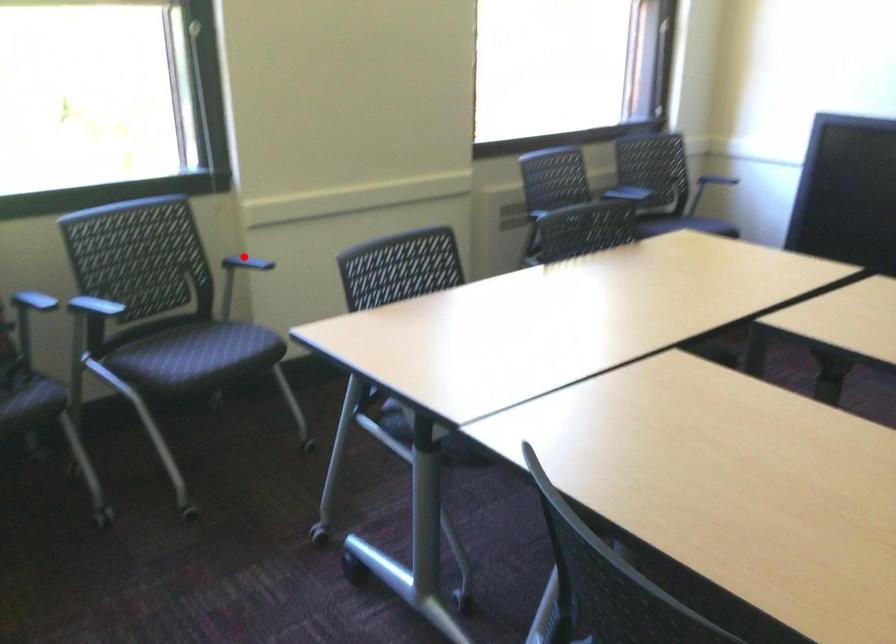
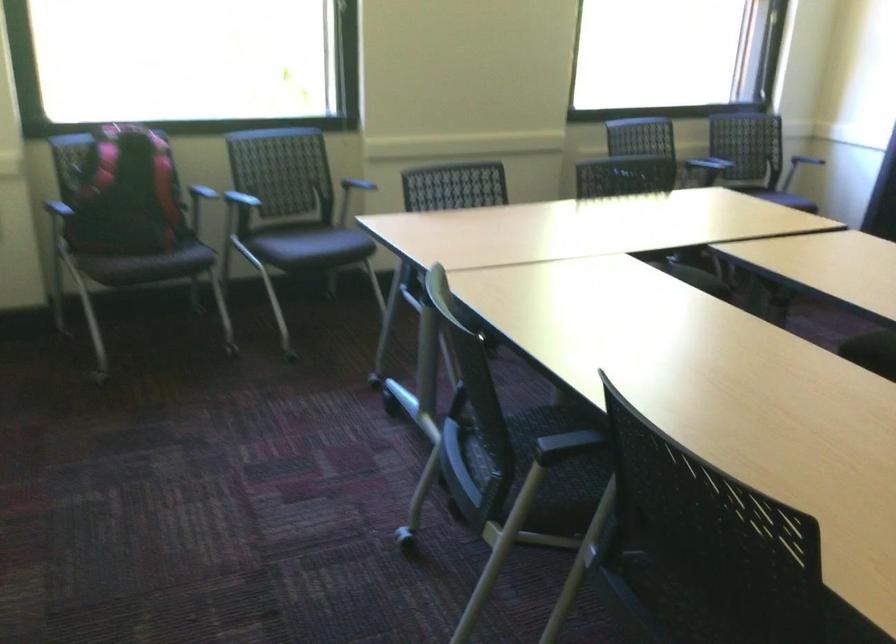
Question: I am providing you with two images of the same scene from different viewpoints. In image1, a red point is highlighted. Considering the same 3D point in image2, which of the following is correct?

Choices:
 (A) It is closer
 (B) It is farther

Answer: (B)